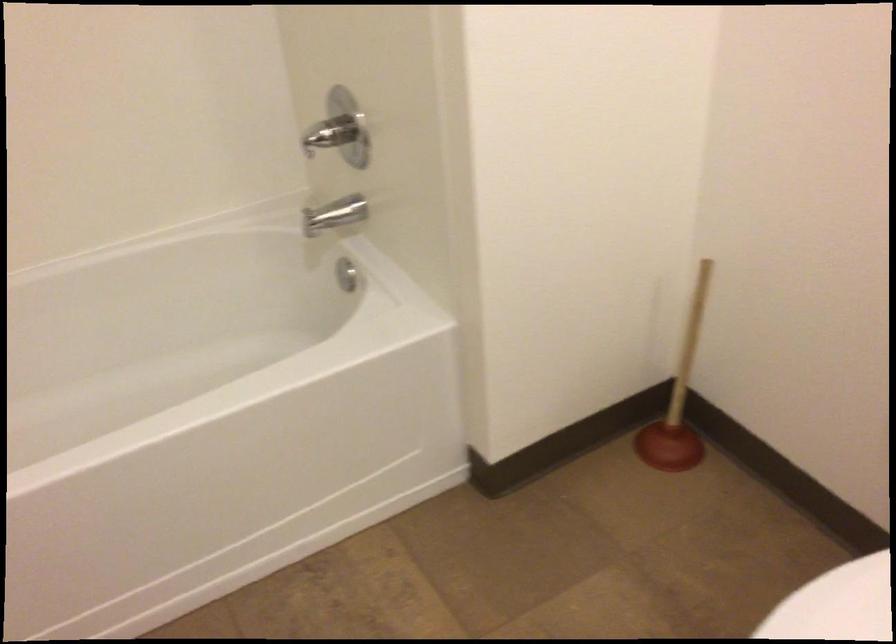
The images are taken continuously from a first-person perspective. In which direction is your viewpoint rotating?

The camera rotated toward left-down.